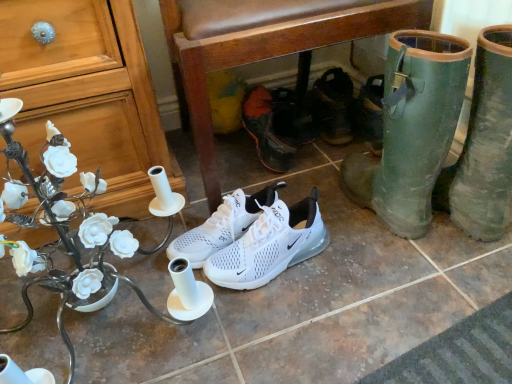
At what (x,y) coordinates should I click in order to perform the action: click on free point below green rubber boots at lower right, marked as the fifth footwear in a back-to-front arrangement (from a real-world perspective). Please return your answer as a coordinate pair (x, y). The image size is (512, 384). Looking at the image, I should click on (372, 218).